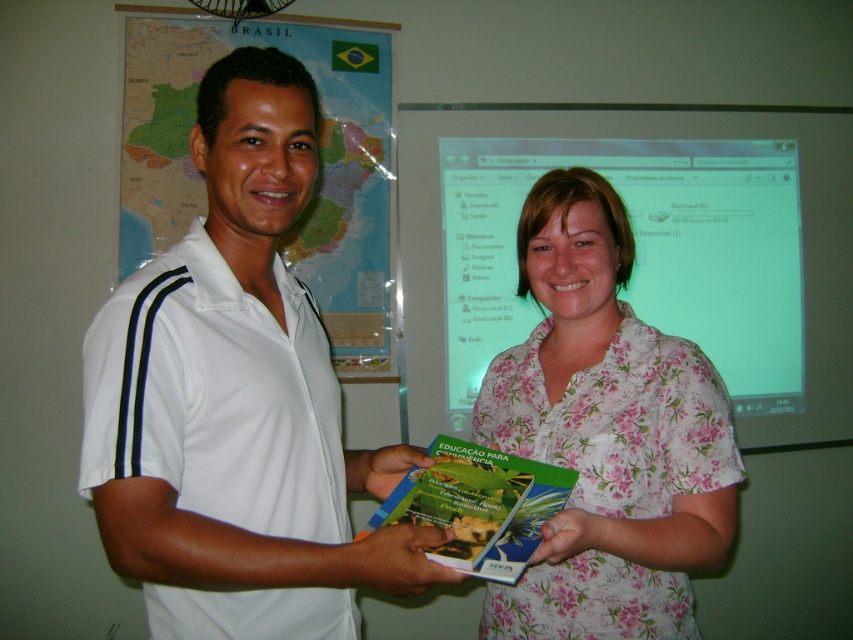
Question: Based on their relative distances, which object is nearer to the green matte book at center?

Choices:
 (A) white smooth shirt at center
 (B) floral fabric shirt at center
 (C) map of brazil at upper left

Answer: (A)

Question: Can you confirm if map of brazil at upper left is positioned above green matte book at center?

Choices:
 (A) yes
 (B) no

Answer: (A)

Question: Considering the real-world distances, which object is farthest from the floral fabric shirt at center?

Choices:
 (A) white smooth shirt at center
 (B) green matte book at center

Answer: (A)

Question: Which point appears closest to the camera in this image?

Choices:
 (A) (200, 97)
 (B) (543, 508)
 (C) (312, 24)
 (D) (637, 541)

Answer: (A)

Question: Is white smooth shirt at center positioned before map of brazil at upper left?

Choices:
 (A) no
 (B) yes

Answer: (B)

Question: Observing the image, what is the correct spatial positioning of floral fabric shirt at center in reference to green matte book at center?

Choices:
 (A) right
 (B) left

Answer: (A)